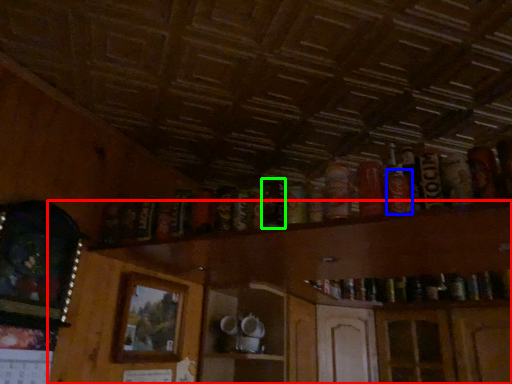
Question: Which is nearer to the dresser (highlighted by a red box)? beer (highlighted by a blue box) or beer (highlighted by a green box).

Choices:
 (A) beer
 (B) beer

Answer: (B)